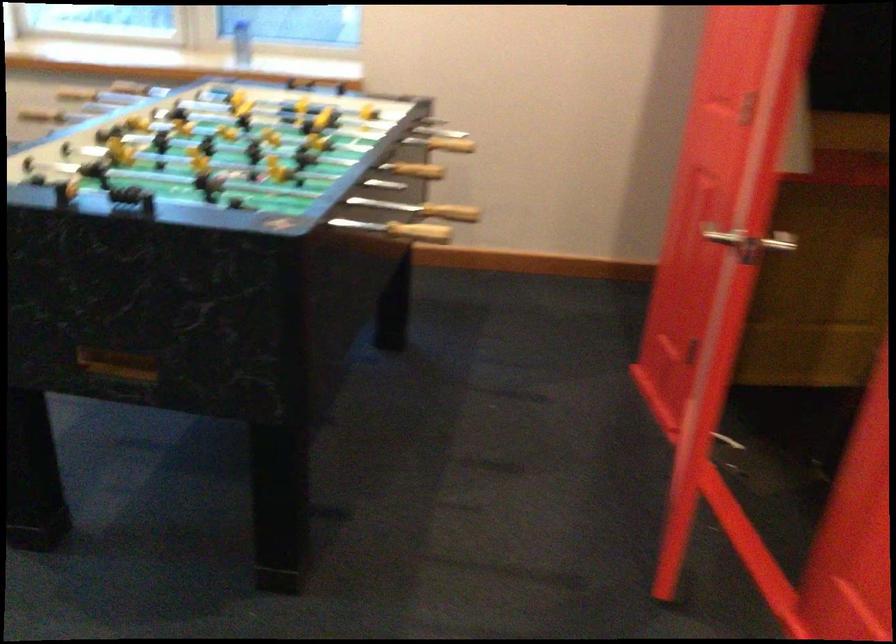
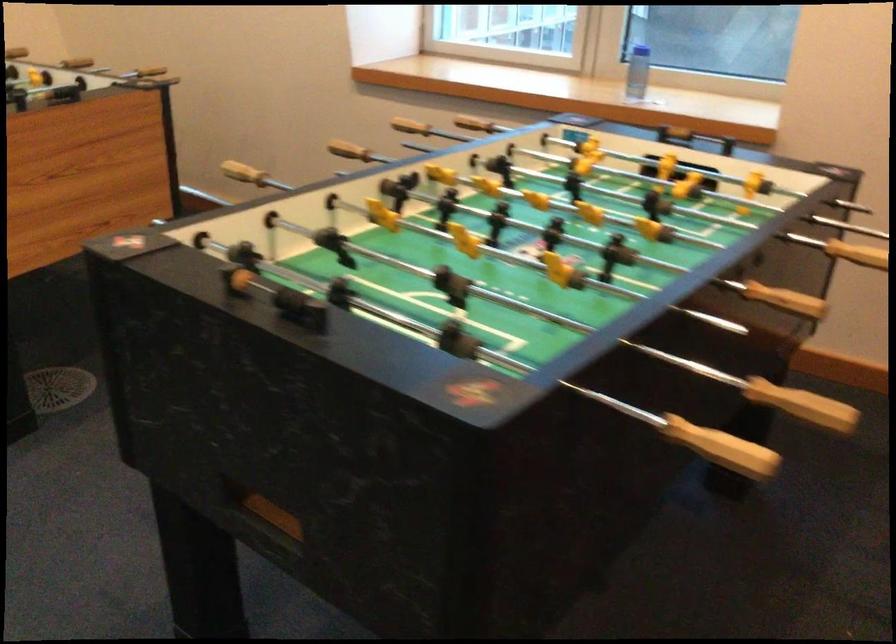
The point at (429, 221) is marked in the first image. Where is the corresponding point in the second image?

(722, 448)